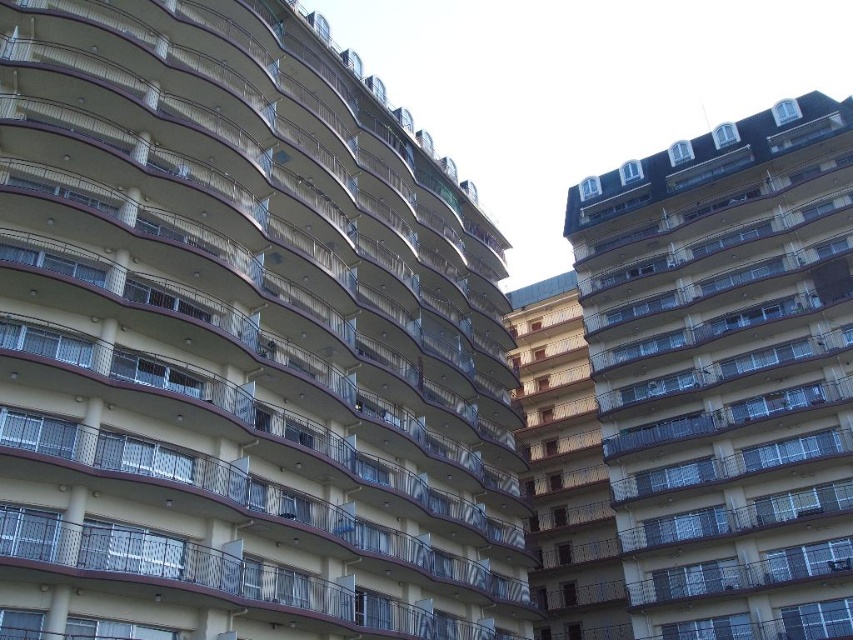
Question: Can you confirm if beige concrete building at upper right is positioned above beige concrete balcony at center?

Choices:
 (A) no
 (B) yes

Answer: (B)

Question: Which point appears farthest from the camera in this image?

Choices:
 (A) (202, 4)
 (B) (741, 442)
 (C) (573, 554)

Answer: (C)

Question: Is beige concrete building at center thinner than beige concrete balcony at center?

Choices:
 (A) yes
 (B) no

Answer: (B)

Question: Does beige concrete building at center appear on the left side of beige concrete balcony at center?

Choices:
 (A) yes
 (B) no

Answer: (A)

Question: Which point is farther to the camera?

Choices:
 (A) coord(614,563)
 (B) coord(502,461)

Answer: (A)

Question: Which point appears farthest from the camera in this image?

Choices:
 (A) (788, 116)
 (B) (318, 163)
 (C) (532, 524)

Answer: (C)